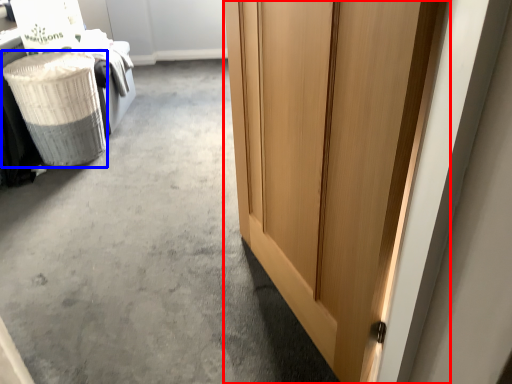
Question: Which point is further to the camera, door (highlighted by a red box) or laundry basket (highlighted by a blue box)?

Choices:
 (A) door
 (B) laundry basket

Answer: (B)